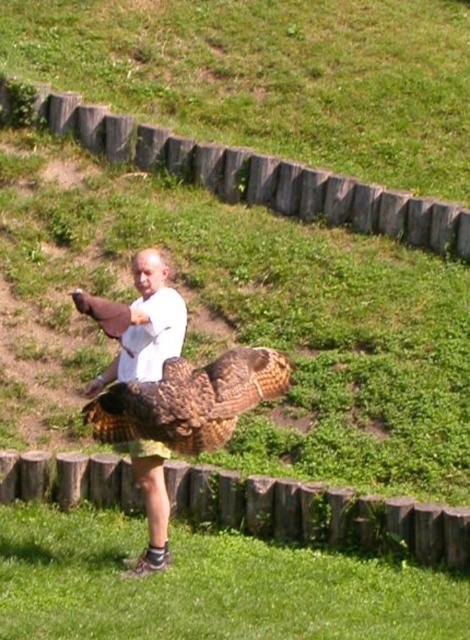
You are a photographer trying to capture the brown feathered eagle at center and the white matte shirt at center in a single shot. Can you frame the shot so that the eagle is visible above the shirt?

The brown feathered eagle at center is positioned under the white matte shirt at center, so it cannot be framed to show the eagle above the shirt.

You are a photographer trying to capture a clear photo of the brown feathered eagle at center and the white matte shirt at center. Which object should you zoom in more on to ensure it appears larger in the photo?

The brown feathered eagle at center is smaller than the white matte shirt at center, so you should zoom in more on the brown feathered eagle at center to make it appear larger in the photo.